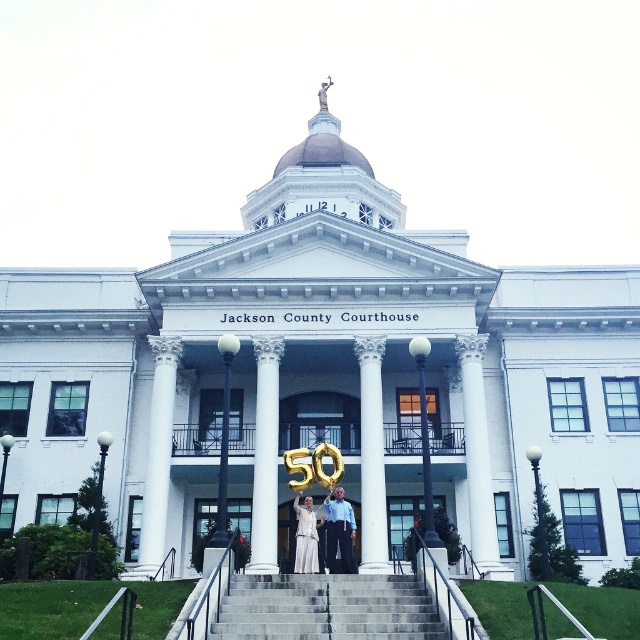
In the scene shown: How distant is white marble column at center from matte gold balloons at center?

white marble column at center is 4.72 meters from matte gold balloons at center.

Which is behind, point (381, 564) or point (346, 557)?

Point (381, 564)

The image size is (640, 640). In order to click on white marble column at center in this screenshot , I will do `click(371, 456)`.

Does gray concrete stairs at center appear under white marble column at center?

Correct, gray concrete stairs at center is located below white marble column at center.

Which is in front, point (236, 627) or point (365, 392)?

Point (236, 627)

Locate an element on the screen. The image size is (640, 640). gray concrete stairs at center is located at coordinates (326, 608).

Identify the location of gray concrete stairs at center. (326, 608).

Between point (371, 540) and point (300, 536), which one is positioned in front?

Positioned in front is point (300, 536).

From the picture: Does white marble column at center have a lesser width compared to white satin dress at center?

No.

Does point (381, 352) come behind point (314, 525)?

Yes, point (381, 352) is behind point (314, 525).

Where is `white marble column at center`? white marble column at center is located at coordinates (371, 456).